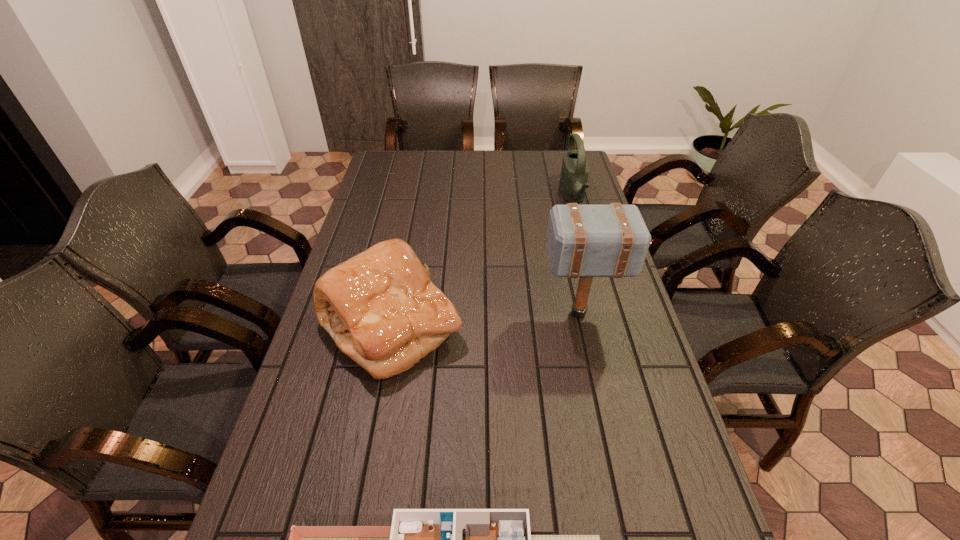
This screenshot has width=960, height=540. I want to click on object present at the far edge, so click(x=574, y=174).

Find the location of `object that is at the left edge`. object that is at the left edge is located at coordinates (380, 307).

Identify the location of mallet positioned at the right edge. [586, 241].

The width and height of the screenshot is (960, 540). In order to click on watering can that is at the right edge in this screenshot , I will do click(574, 174).

This screenshot has height=540, width=960. Identify the location of object at the far right corner. (574, 174).

Where is `vacant space at the far edge of the desktop`? This screenshot has height=540, width=960. vacant space at the far edge of the desktop is located at coordinates (497, 174).

In the image, there is a desktop. At what (x,y) coordinates should I click in order to perform the action: click on vacant space at the left edge. Please return your answer as a coordinate pair (x, y). Looking at the image, I should click on (321, 386).

This screenshot has width=960, height=540. In the image, there is a desktop. Identify the location of vacant space at the right edge. (587, 337).

This screenshot has height=540, width=960. In the image, there is a desktop. In order to click on vacant space at the far left corner in this screenshot , I will do `click(393, 156)`.

Image resolution: width=960 pixels, height=540 pixels. I want to click on free point between the bread and the farthest object, so click(482, 261).